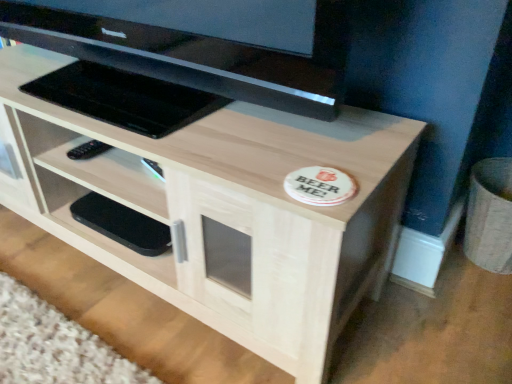
Question: Does light wood/texture tv stand at center have a smaller size compared to black glossy television at upper center?

Choices:
 (A) no
 (B) yes

Answer: (A)

Question: Is light wood/texture tv stand at center oriented towards black glossy television at upper center?

Choices:
 (A) no
 (B) yes

Answer: (A)

Question: Can we say light wood/texture tv stand at center lies outside black glossy television at upper center?

Choices:
 (A) no
 (B) yes

Answer: (B)

Question: From the image's perspective, is light wood/texture tv stand at center located beneath black glossy television at upper center?

Choices:
 (A) no
 (B) yes

Answer: (B)

Question: Is light wood/texture tv stand at center further to camera compared to black glossy television at upper center?

Choices:
 (A) no
 (B) yes

Answer: (B)

Question: Considering their positions, is black glossy television at upper center located in front of or behind light wood/texture tv stand at center?

Choices:
 (A) front
 (B) behind

Answer: (A)

Question: In terms of height, does black glossy television at upper center look taller or shorter compared to light wood/texture tv stand at center?

Choices:
 (A) tall
 (B) short

Answer: (B)

Question: From a real-world perspective, is black glossy television at upper center physically located above or below light wood/texture tv stand at center?

Choices:
 (A) below
 (B) above

Answer: (B)

Question: In terms of width, does black glossy television at upper center look wider or thinner when compared to light wood/texture tv stand at center?

Choices:
 (A) wide
 (B) thin

Answer: (B)

Question: Is light wood/texture tv stand at center inside the boundaries of black glossy television at upper center, or outside?

Choices:
 (A) outside
 (B) inside

Answer: (A)

Question: In the image, is light wood/texture tv stand at center positioned in front of or behind black glossy television at upper center?

Choices:
 (A) front
 (B) behind

Answer: (B)

Question: Considering the positions of light wood/texture tv stand at center and black glossy television at upper center in the image, is light wood/texture tv stand at center bigger or smaller than black glossy television at upper center?

Choices:
 (A) big
 (B) small

Answer: (A)

Question: From a real-world perspective, is light wood/texture tv stand at center physically located above or below black glossy television at upper center?

Choices:
 (A) above
 (B) below

Answer: (B)

Question: From a real-world perspective, is black matte phone at lower left above or below black glossy television at upper center?

Choices:
 (A) below
 (B) above

Answer: (A)

Question: From the image's perspective, is black matte phone at lower left positioned above or below black glossy television at upper center?

Choices:
 (A) above
 (B) below

Answer: (B)